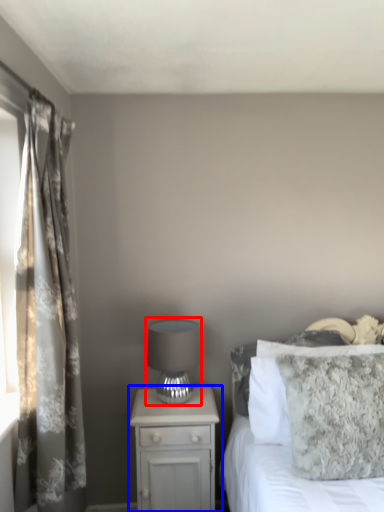
Question: Which object appears farthest to the camera in this image, table lamp (highlighted by a red box) or nightstand (highlighted by a blue box)?

Choices:
 (A) table lamp
 (B) nightstand

Answer: (B)